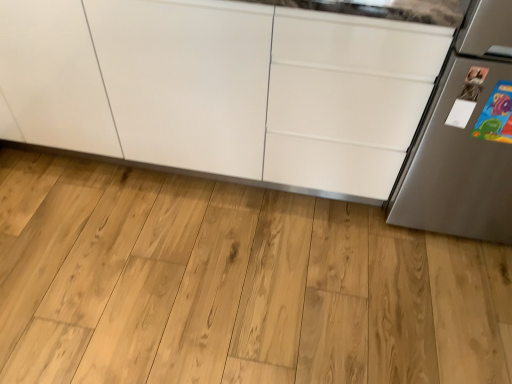
Question: Is white glossy cabinet at center shorter than natural wood flooring at center?

Choices:
 (A) no
 (B) yes

Answer: (A)

Question: Is natural wood flooring at center at the back of white glossy cabinet at center?

Choices:
 (A) yes
 (B) no

Answer: (B)

Question: From the image's perspective, is white glossy cabinet at center located beneath natural wood flooring at center?

Choices:
 (A) yes
 (B) no

Answer: (B)

Question: Is white glossy cabinet at center placed right next to natural wood flooring at center?

Choices:
 (A) yes
 (B) no

Answer: (B)

Question: Would you say white glossy cabinet at center is a long distance from natural wood flooring at center?

Choices:
 (A) yes
 (B) no

Answer: (B)

Question: Is point (406, 36) closer or farther from the camera than point (398, 322)?

Choices:
 (A) closer
 (B) farther

Answer: (A)

Question: Relative to natural wood flooring at center, is white glossy cabinet at center in front or behind?

Choices:
 (A) front
 (B) behind

Answer: (A)

Question: Considering the positions of white glossy cabinet at center and natural wood flooring at center in the image, is white glossy cabinet at center wider or thinner than natural wood flooring at center?

Choices:
 (A) thin
 (B) wide

Answer: (A)

Question: Based on their positions, is white glossy cabinet at center located to the left or right of natural wood flooring at center?

Choices:
 (A) right
 (B) left

Answer: (B)

Question: Based on their positions, is satin silver refrigerator at right located to the left or right of natural wood flooring at center?

Choices:
 (A) right
 (B) left

Answer: (A)

Question: From the image's perspective, is satin silver refrigerator at right positioned above or below natural wood flooring at center?

Choices:
 (A) below
 (B) above

Answer: (B)

Question: Is satin silver refrigerator at right bigger or smaller than natural wood flooring at center?

Choices:
 (A) small
 (B) big

Answer: (B)

Question: In terms of width, does satin silver refrigerator at right look wider or thinner when compared to natural wood flooring at center?

Choices:
 (A) wide
 (B) thin

Answer: (B)

Question: Would you say natural wood flooring at center is to the left or to the right of white glossy cabinet at center in the picture?

Choices:
 (A) left
 (B) right

Answer: (B)

Question: From a real-world perspective, relative to white glossy cabinet at center, is natural wood flooring at center vertically above or below?

Choices:
 (A) below
 (B) above

Answer: (A)